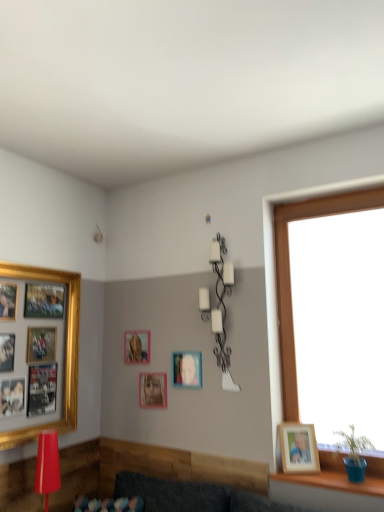
Question: From a real-world perspective, is blue plastic pot at lower right physically located above or below wooden photo frame at right, which is the 1th picture frame from right to left?

Choices:
 (A) above
 (B) below

Answer: (B)

Question: From the image's perspective, is blue plastic pot at lower right above or below wooden photo frame at right, the fifth picture frame positioned from the left?

Choices:
 (A) above
 (B) below

Answer: (B)

Question: Which object is the closest to the matte plastic picture frame at center, which ranks as the 4th picture frame in left-to-right order?

Choices:
 (A) wooden photo frame at right, which is the 1th picture frame from right to left
 (B) matte red lamp at lower left, marked as the 2th lamp in a right-to-left arrangement
 (C) white matte wall sconce at upper center, which appears as the first lamp when viewed from the back
 (D) pink matte picture frame at center, which appears as the 3th picture frame when viewed from the right
 (E) gold-framed collage at left, which ranks as the fifth picture frame in right-to-left order

Answer: (D)

Question: Which of these objects is positioned farthest from the matte red lamp at lower left, which is counted as the second lamp, starting from the top?

Choices:
 (A) blue plastic pot at lower right
 (B) matte gold picture frame at center, arranged as the 4th picture frame when viewed from the right
 (C) pink matte picture frame at center, the third picture frame from the left
 (D) matte plastic picture frame at center, placed as the 2th picture frame when sorted from right to left
 (E) wooden photo frame at right, which is the 1th picture frame from right to left

Answer: (A)